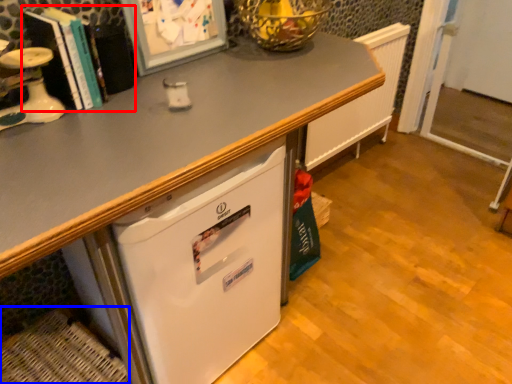
Question: Which object appears closest to the camera in this image, book (highlighted by a red box) or basket (highlighted by a blue box)?

Choices:
 (A) book
 (B) basket

Answer: (A)